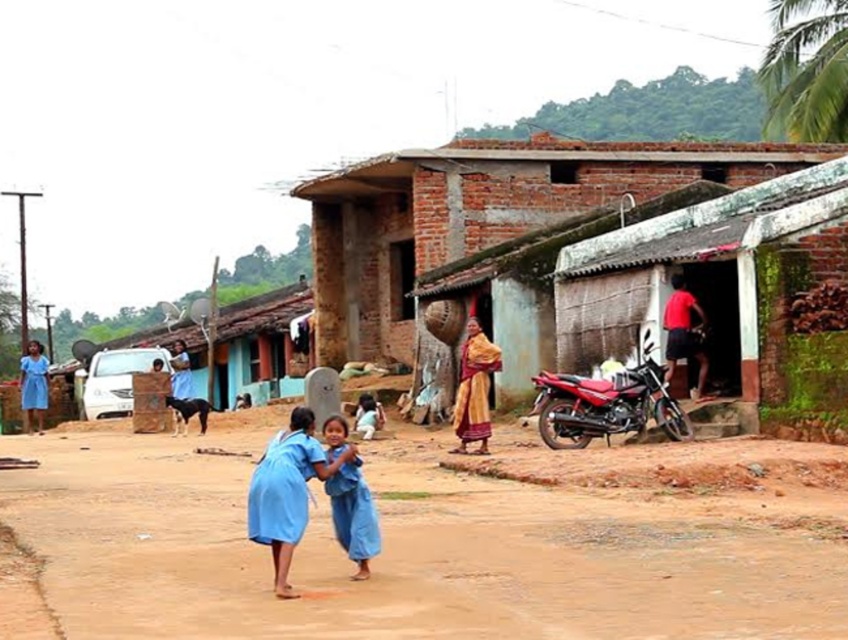
Which is more to the right, blue cotton dress at center or matte blue dress at left?

From the viewer's perspective, blue cotton dress at center appears more on the right side.

Does blue cotton dress at center appear on the right side of matte blue dress at left?

Yes, blue cotton dress at center is to the right of matte blue dress at left.

Does point (352, 579) come closer to viewer compared to point (32, 392)?

Yes, it is.

Find the location of a particular element. blue cotton dress at center is located at coordinates (353, 515).

Looking at this image, between brick wall hut at center and blue cotton dress at center, which one is positioned higher?

brick wall hut at center is higher up.

Can you confirm if brick wall hut at center is positioned to the right of blue cotton dress at center?

Correct, you'll find brick wall hut at center to the right of blue cotton dress at center.

Locate an element on the screen. The image size is (848, 640). brick wall hut at center is located at coordinates (483, 214).

Identify the location of brick wall hut at center. (483, 214).

Who is higher up, red matte motorcycle at right or gold textured shawl at center?

Positioned higher is gold textured shawl at center.

Between point (586, 394) and point (470, 436), which one is positioned in front?

Point (586, 394) is more forward.

Locate an element on the screen. This screenshot has height=640, width=848. red matte motorcycle at right is located at coordinates (606, 404).